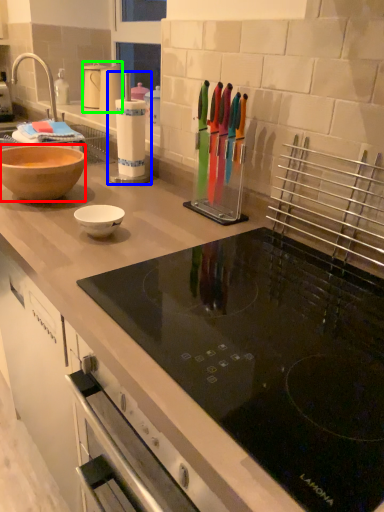
Question: Estimate the real-world distances between objects in this image. Which object is farther from bowl (highlighted by a red box), appliance (highlighted by a blue box) or kitchen appliance (highlighted by a green box)?

Choices:
 (A) appliance
 (B) kitchen appliance

Answer: (B)